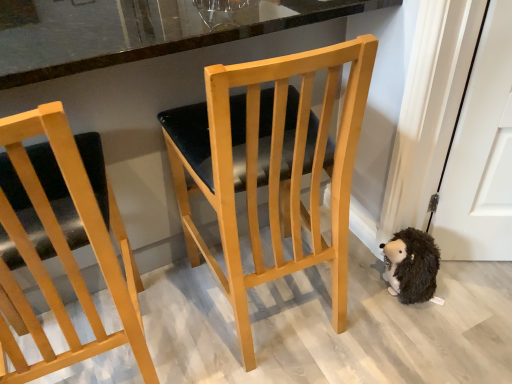
Question: Is light wood chair at left, which appears as the first chair when viewed from the left, to the left of light wood chair at center, acting as the first chair starting from the right, from the viewer's perspective?

Choices:
 (A) no
 (B) yes

Answer: (B)

Question: Can you confirm if light wood chair at left, placed as the second chair when sorted from right to left, is positioned to the right of light wood chair at center, acting as the first chair starting from the right?

Choices:
 (A) yes
 (B) no

Answer: (B)

Question: Can you confirm if light wood chair at left, placed as the second chair when sorted from right to left, is wider than light wood chair at center, arranged as the 2th chair when viewed from the left?

Choices:
 (A) yes
 (B) no

Answer: (B)

Question: Is light wood chair at left, which appears as the first chair when viewed from the left, positioned beyond the bounds of light wood chair at center, arranged as the 2th chair when viewed from the left?

Choices:
 (A) no
 (B) yes

Answer: (B)

Question: Does light wood chair at left, placed as the second chair when sorted from right to left, touch light wood chair at center, acting as the first chair starting from the right?

Choices:
 (A) no
 (B) yes

Answer: (A)

Question: Is light wood chair at left, placed as the second chair when sorted from right to left, behind light wood chair at center, acting as the first chair starting from the right?

Choices:
 (A) no
 (B) yes

Answer: (A)

Question: Is light wood chair at center, arranged as the 2th chair when viewed from the left, at the left side of light wood chair at left, placed as the second chair when sorted from right to left?

Choices:
 (A) no
 (B) yes

Answer: (A)

Question: Considering the relative sizes of light wood chair at center, arranged as the 2th chair when viewed from the left, and light wood chair at left, which appears as the first chair when viewed from the left, in the image provided, is light wood chair at center, arranged as the 2th chair when viewed from the left, taller than light wood chair at left, which appears as the first chair when viewed from the left,?

Choices:
 (A) no
 (B) yes

Answer: (A)

Question: Is the position of light wood chair at center, arranged as the 2th chair when viewed from the left, more distant than that of light wood chair at left, which appears as the first chair when viewed from the left?

Choices:
 (A) no
 (B) yes

Answer: (B)

Question: Can you confirm if light wood chair at center, arranged as the 2th chair when viewed from the left, is shorter than light wood chair at left, which appears as the first chair when viewed from the left?

Choices:
 (A) no
 (B) yes

Answer: (B)

Question: Can you confirm if light wood chair at center, acting as the first chair starting from the right, is smaller than light wood chair at left, placed as the second chair when sorted from right to left?

Choices:
 (A) yes
 (B) no

Answer: (B)

Question: Is light wood chair at center, arranged as the 2th chair when viewed from the left, placed right next to light wood chair at left, which appears as the first chair when viewed from the left?

Choices:
 (A) no
 (B) yes

Answer: (A)

Question: Is black fuzzy stuffed animal at lower right turned away from light wood chair at center, arranged as the 2th chair when viewed from the left?

Choices:
 (A) yes
 (B) no

Answer: (B)